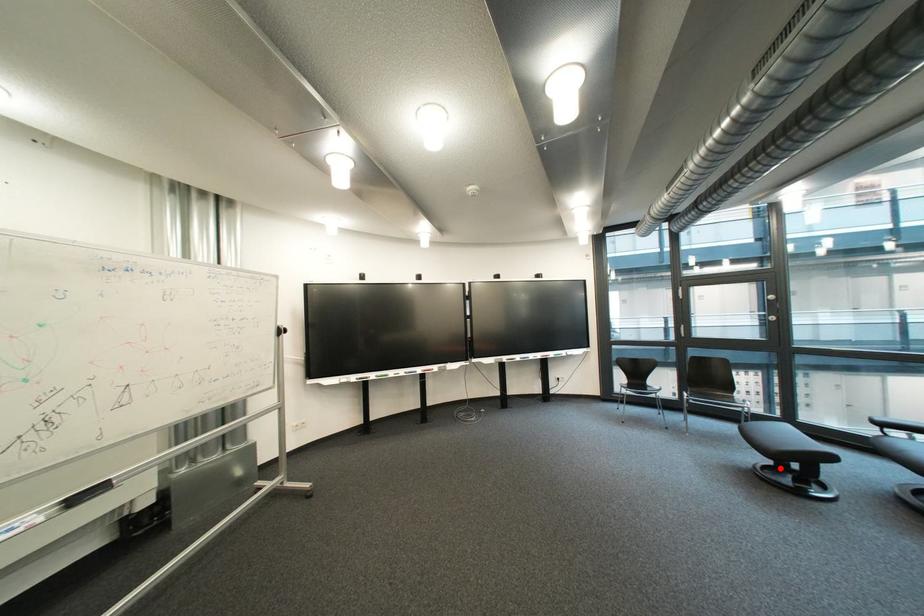
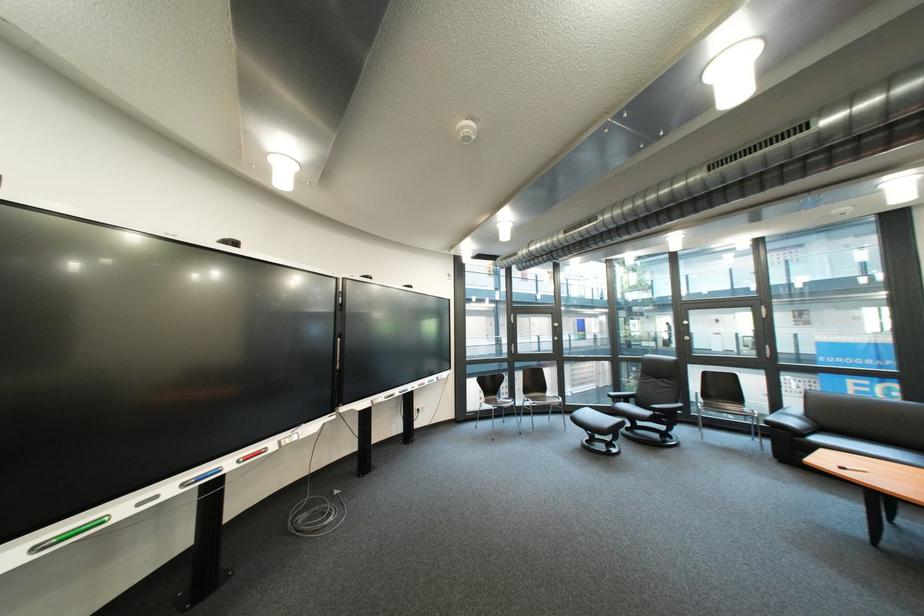
In the second image, find the point that corresponds to the highlighted location in the first image.

(601, 443)